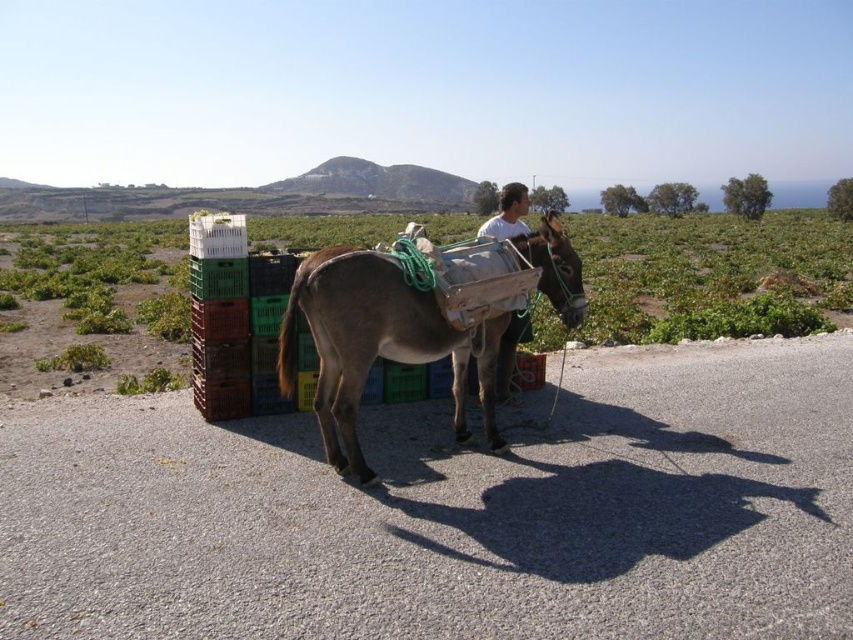
Question: Which object is farther from the camera taking this photo?

Choices:
 (A) green plastic crates at center
 (B) light brown leather pants at center

Answer: (A)

Question: Is green plastic crates at center smaller than light brown leather pants at center?

Choices:
 (A) no
 (B) yes

Answer: (A)

Question: Which object is closer to the camera taking this photo?

Choices:
 (A) brown textured donkey at center
 (B) green plastic crates at center
 (C) light brown leather pants at center

Answer: (A)

Question: Where is green plastic crates at center located in relation to light brown leather pants at center in the image?

Choices:
 (A) below
 (B) above

Answer: (B)

Question: From the image, what is the correct spatial relationship of brown textured donkey at center in relation to light brown leather pants at center?

Choices:
 (A) left
 (B) right

Answer: (A)

Question: Which point is farther from the camera taking this photo?

Choices:
 (A) pos(326,456)
 (B) pos(177,228)
 (C) pos(505,212)

Answer: (B)